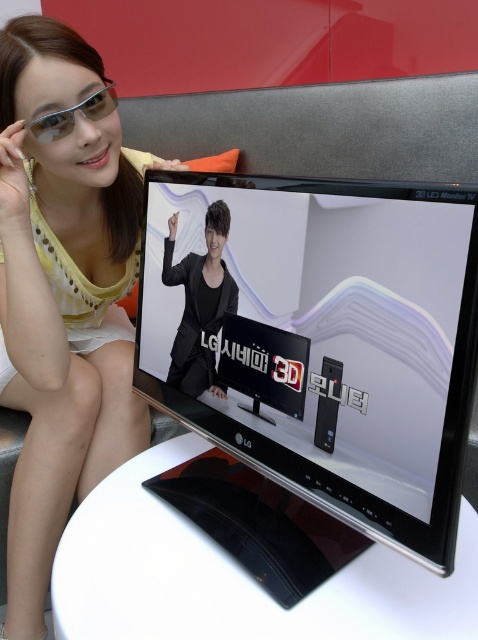
Question: Which point appears farthest from the camera in this image?

Choices:
 (A) click(x=219, y=548)
 (B) click(x=171, y=257)

Answer: (B)

Question: Does matte yellow dress at upper left have a smaller size compared to black matte jacket at center?

Choices:
 (A) no
 (B) yes

Answer: (A)

Question: Which point is farther to the camera?

Choices:
 (A) black matte jacket at center
 (B) matte yellow dress at upper left
 (C) black glossy monitor at center
 (D) white glossy table at center

Answer: (B)

Question: Which point is closer to the camera taking this photo?

Choices:
 (A) (47, 136)
 (B) (19, 243)
 (C) (172, 237)

Answer: (A)

Question: Can you confirm if matte yellow dress at upper left is wider than white glossy table at center?

Choices:
 (A) no
 (B) yes

Answer: (A)

Question: Considering the relative positions of matte yellow dress at upper left and black matte jacket at center in the image provided, where is matte yellow dress at upper left located with respect to black matte jacket at center?

Choices:
 (A) left
 (B) right

Answer: (A)